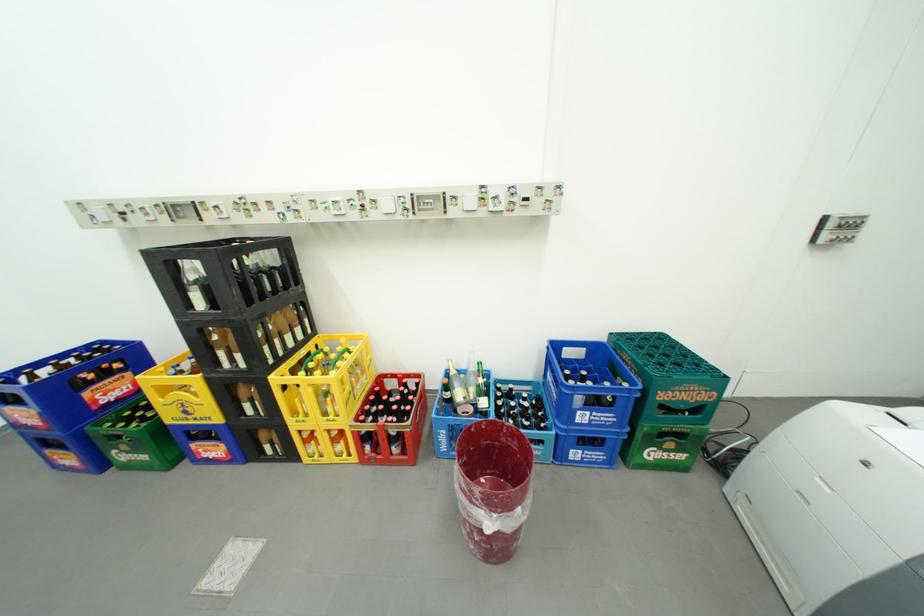
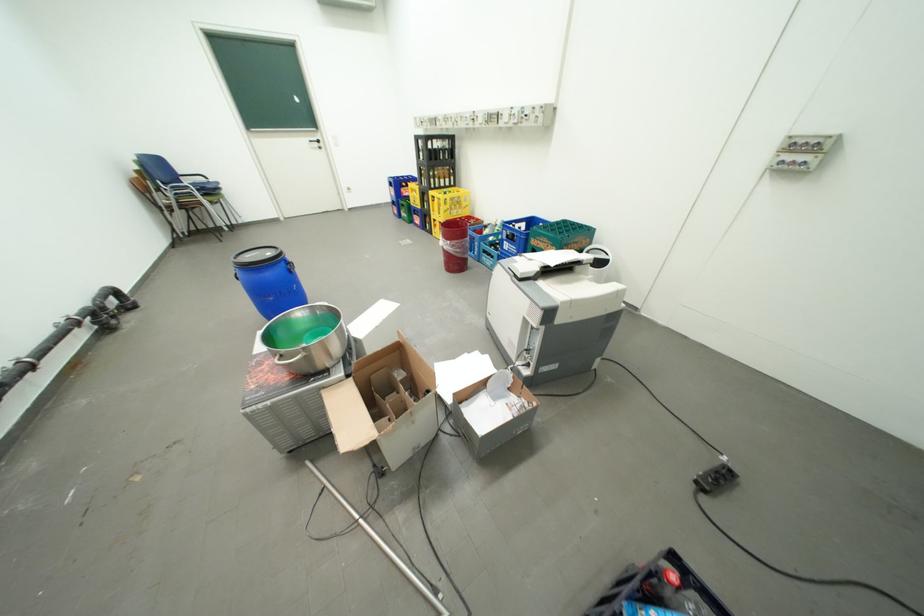
Find the pixel in the second image that matches (x=200, y=308) in the first image.

(430, 159)